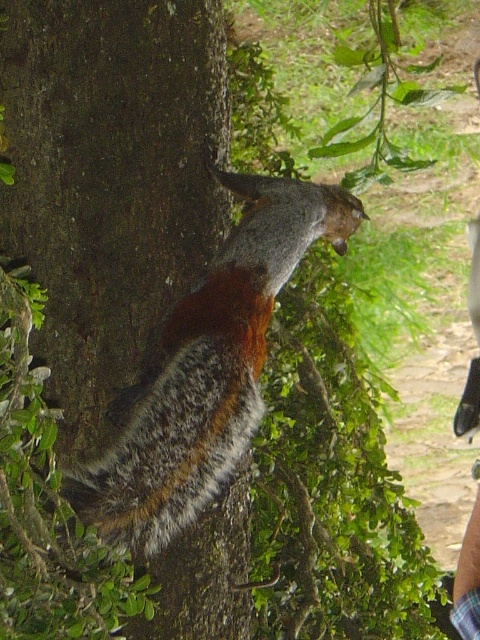
Is point (13, 134) in front of point (133, 472)?

No, (13, 134) is behind (133, 472).

Is brown rough bark at center to the right of fuzzy brown fur at center from the viewer's perspective?

No, brown rough bark at center is not to the right of fuzzy brown fur at center.

Between point (216, 131) and point (241, 403), which one is positioned in front?

Point (241, 403) is in front.

This screenshot has height=640, width=480. I want to click on brown rough bark at center, so click(x=109, y=179).